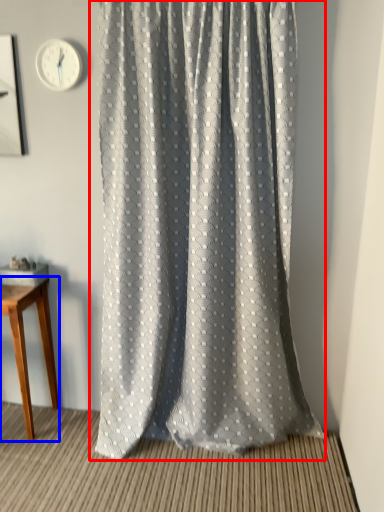
Question: Which object appears farthest to the camera in this image, curtain (highlighted by a red box) or table (highlighted by a blue box)?

Choices:
 (A) curtain
 (B) table

Answer: (B)